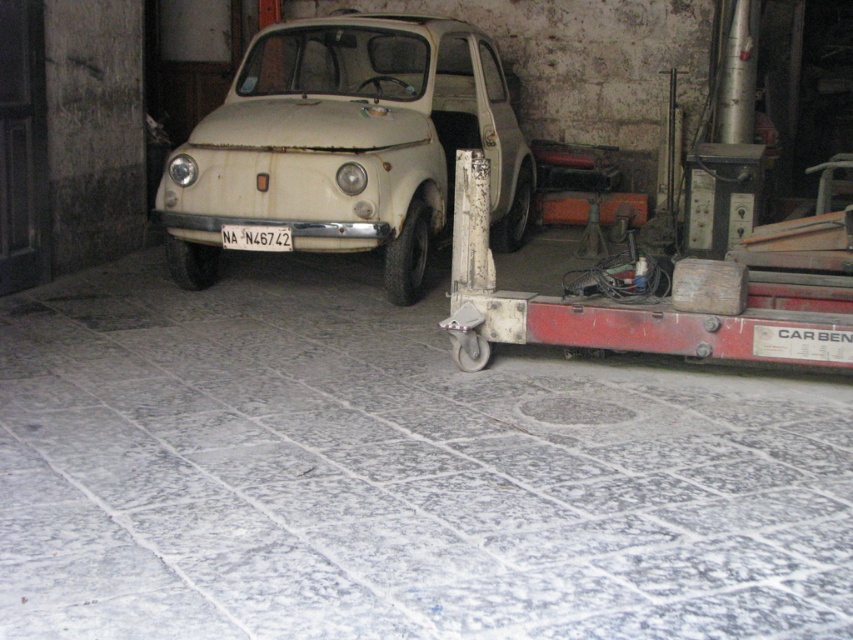
Question: Among these objects, which one is farthest from the camera?

Choices:
 (A) white plastic license plate at center
 (B) white matte car at center

Answer: (A)

Question: Is white matte car at center bigger than white plastic license plate at center?

Choices:
 (A) no
 (B) yes

Answer: (B)

Question: Which point is farther from the camera taking this photo?

Choices:
 (A) (346, 116)
 (B) (260, 244)

Answer: (A)

Question: Is white matte car at center wider than white plastic license plate at center?

Choices:
 (A) no
 (B) yes

Answer: (B)

Question: Which point appears closest to the camera in this image?

Choices:
 (A) (251, 248)
 (B) (369, 38)

Answer: (A)

Question: Is white matte car at center to the right of white plastic license plate at center from the viewer's perspective?

Choices:
 (A) yes
 (B) no

Answer: (A)